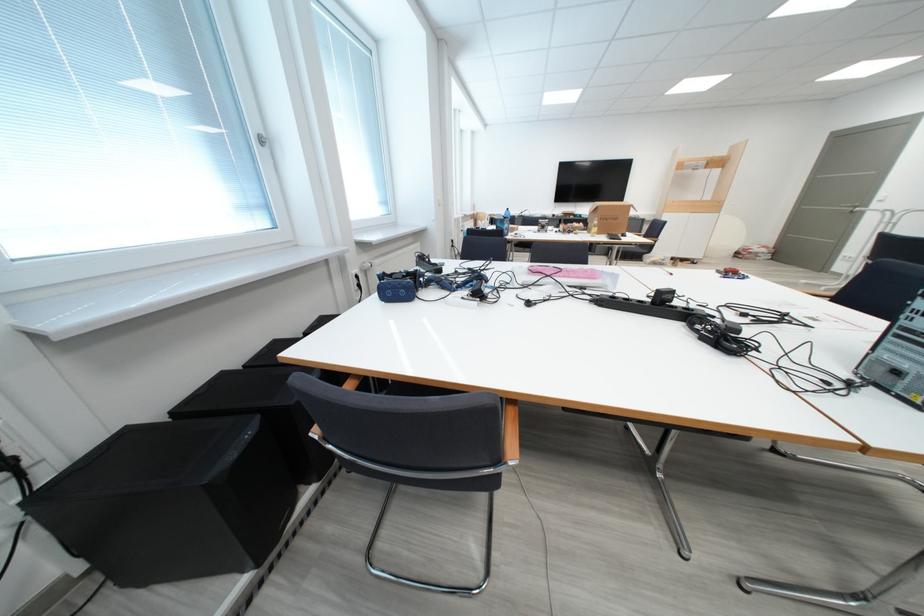
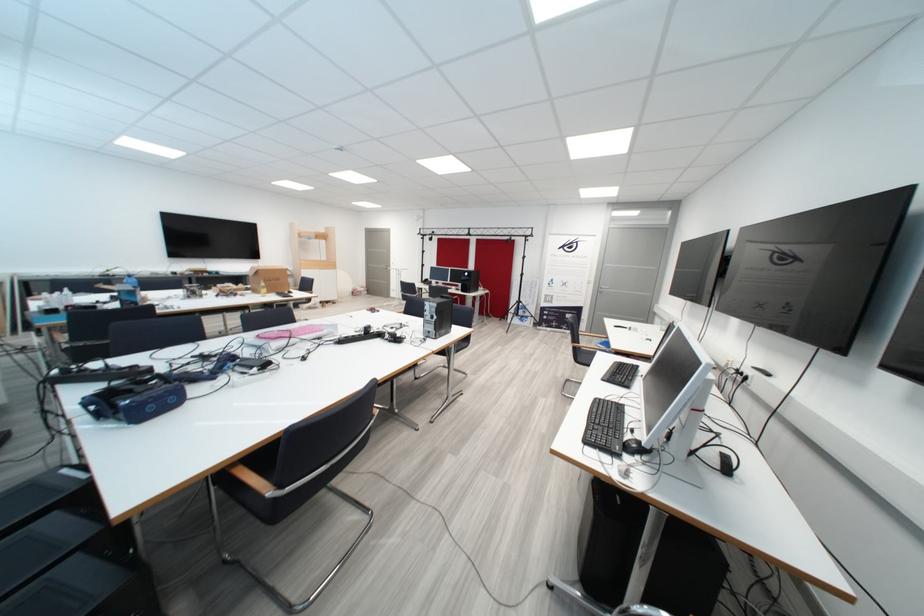
Question: Based on the continuous images, in which direction is the camera rotating? Reply with the corresponding letter.

Choices:
 (A) Left
 (B) Right
 (C) Up
 (D) Down

Answer: (B)